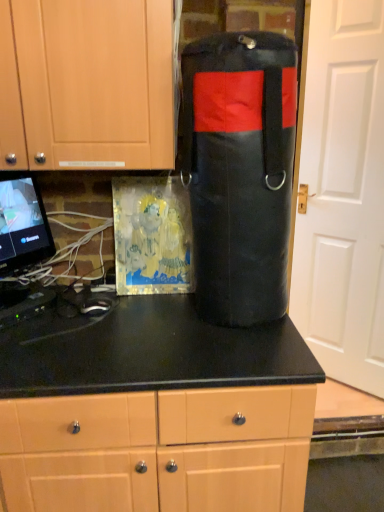
Question: Can you confirm if white matte door at right is positioned to the left of matte black countertop at center, acting as the second cabinetry starting from the top?

Choices:
 (A) yes
 (B) no

Answer: (B)

Question: Could you tell me if white matte door at right is facing matte black countertop at center, acting as the second cabinetry starting from the top?

Choices:
 (A) yes
 (B) no

Answer: (A)

Question: Considering the relative positions of white matte door at right and matte black countertop at center, the first cabinetry positioned from the bottom, in the image provided, is white matte door at right to the right of matte black countertop at center, the first cabinetry positioned from the bottom, from the viewer's perspective?

Choices:
 (A) no
 (B) yes

Answer: (B)

Question: Is white matte door at right outside of matte black countertop at center, acting as the second cabinetry starting from the top?

Choices:
 (A) no
 (B) yes

Answer: (B)

Question: Can you confirm if white matte door at right is smaller than matte black countertop at center, acting as the second cabinetry starting from the top?

Choices:
 (A) no
 (B) yes

Answer: (B)

Question: Based on their sizes in the image, would you say black leather punching bag at center is bigger or smaller than matte black countertop at center, the first cabinetry positioned from the bottom?

Choices:
 (A) small
 (B) big

Answer: (A)

Question: Is black leather punching bag at center wider or thinner than matte black countertop at center, the first cabinetry positioned from the bottom?

Choices:
 (A) wide
 (B) thin

Answer: (B)

Question: Do you think black leather punching bag at center is within matte black countertop at center, acting as the second cabinetry starting from the top, or outside of it?

Choices:
 (A) inside
 (B) outside

Answer: (B)

Question: Considering the positions of black leather punching bag at center and matte black countertop at center, the first cabinetry positioned from the bottom, in the image, is black leather punching bag at center taller or shorter than matte black countertop at center, the first cabinetry positioned from the bottom,?

Choices:
 (A) short
 (B) tall

Answer: (A)

Question: Based on their sizes in the image, would you say black leather punching bag at center is bigger or smaller than white matte door at right?

Choices:
 (A) small
 (B) big

Answer: (A)

Question: Would you say black leather punching bag at center is inside or outside white matte door at right?

Choices:
 (A) inside
 (B) outside

Answer: (B)

Question: Is black leather punching bag at center taller or shorter than white matte door at right?

Choices:
 (A) tall
 (B) short

Answer: (B)

Question: Considering the positions of point (246, 169) and point (349, 231), is point (246, 169) closer or farther from the camera than point (349, 231)?

Choices:
 (A) farther
 (B) closer

Answer: (B)

Question: Considering the positions of matte black countertop at center, acting as the second cabinetry starting from the top, and black leather punching bag at center in the image, is matte black countertop at center, acting as the second cabinetry starting from the top, wider or thinner than black leather punching bag at center?

Choices:
 (A) wide
 (B) thin

Answer: (A)

Question: From a real-world perspective, is matte black countertop at center, the first cabinetry positioned from the bottom, physically located above or below black leather punching bag at center?

Choices:
 (A) below
 (B) above

Answer: (A)